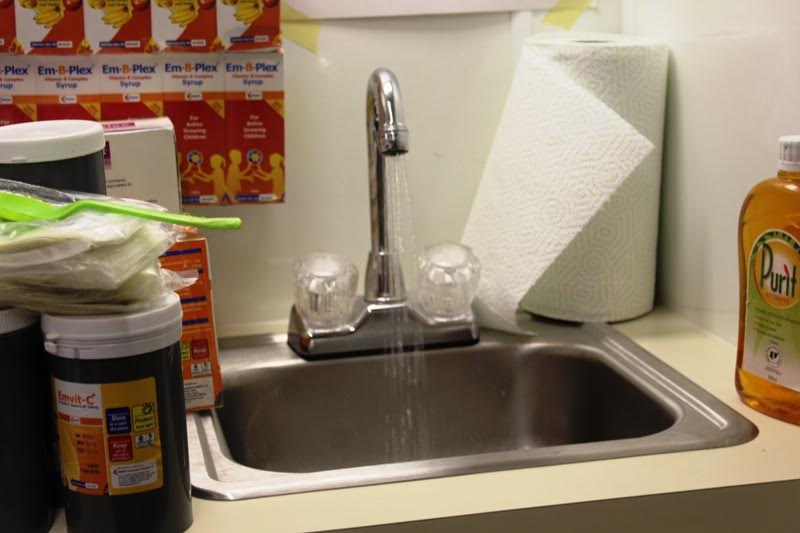
You are a GUI agent. You are given a task and a screenshot of the screen. Output one action in this format:
    pyautogui.click(x=<x>, y=<y>)
    Task: Click on the sink
    The height and width of the screenshot is (533, 800).
    Given the screenshot: What is the action you would take?
    pyautogui.click(x=462, y=422)